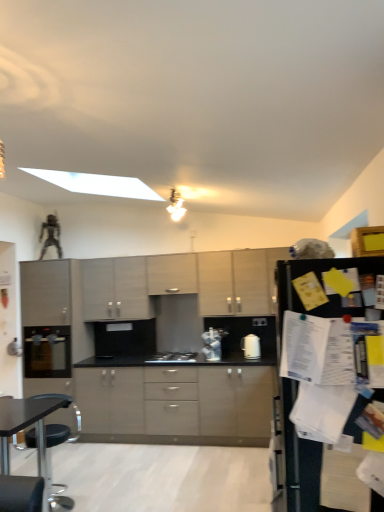
What are the coordinates of `vacant space in front of white glossy paper towel dispenser at center` in the screenshot? It's located at (252, 362).